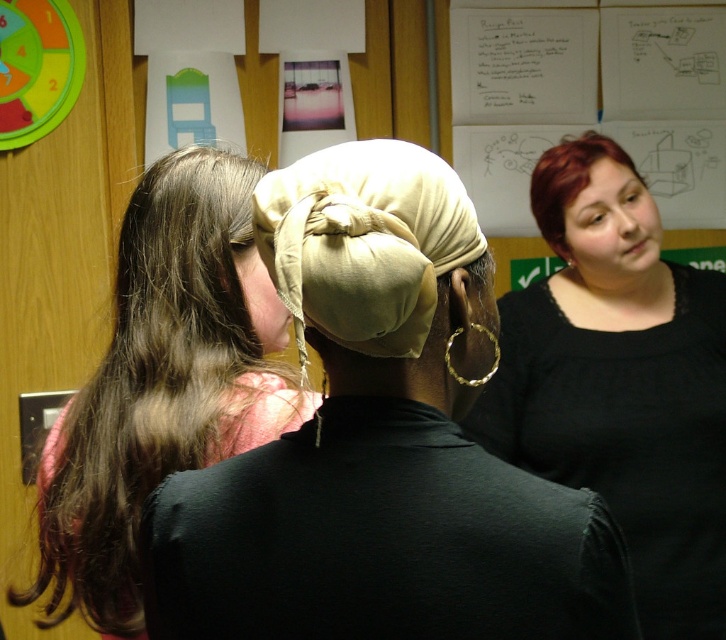
You are organizing a clothing donation drive and need to categorize items by size. You have two items to sort today. The first is a matte black shirt at upper right and the second is a beige fabric headscarf at center. Based on their sizes, which item should be placed in the large size bin?

The matte black shirt at upper right should be placed in the large size bin because it has a larger size compared to the beige fabric headscarf at center.

You are a photographer standing in front of the scene. You want to take a photo of the matte black shirt at upper right and the matte black head at right. The camera has a minimum focus distance of 16 centimeters. Will both subjects be in focus?

The matte black shirt at upper right and matte black head at right are 16.57 centimeters apart from each other. Since the minimum focus distance is 16 centimeters, the camera can focus on both subjects as they are within the required distance.

You are a photographer trying to capture a group photo of the dark brown hair at left and the matte black head at right. Since you want to ensure both are fully visible in the frame, which person should you position closer to the camera?

To ensure both the dark brown hair at left and the matte black head at right are fully visible in the frame, position the matte black head at right closer to the camera since it has a shorter height compared to the dark brown hair at left.